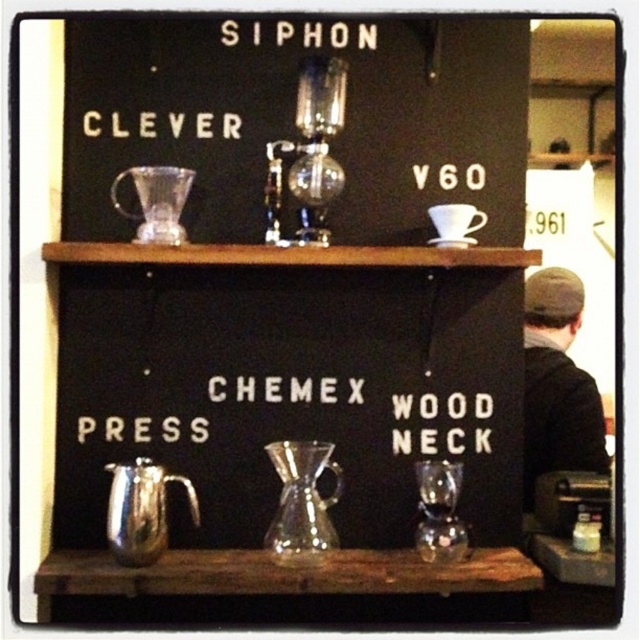
Who is taller, clear glass carafe at upper center or white ceramic cup at upper center?

With more height is clear glass carafe at upper center.

Which is behind, point (212, 88) or point (468, 211)?

The point (212, 88) is behind.

Where is `clear glass carafe at upper center`? The image size is (640, 640). clear glass carafe at upper center is located at coordinates (292, 118).

Is clear glass carafe at upper center positioned in front of dark gray knit cap at right?

Yes, clear glass carafe at upper center is closer to the viewer.

Does clear glass carafe at upper center appear under dark gray knit cap at right?

Incorrect, clear glass carafe at upper center is not positioned below dark gray knit cap at right.

Who is more forward, (92,90) or (552,394)?

Point (92,90) is more forward.

I want to click on clear glass carafe at upper center, so click(x=292, y=118).

Does clear glass carafe at upper center appear on the right side of white plastic chemex press at center?

Indeed, clear glass carafe at upper center is positioned on the right side of white plastic chemex press at center.

Is the position of clear glass carafe at upper center more distant than that of white plastic chemex press at center?

No, clear glass carafe at upper center is in front of white plastic chemex press at center.

Does point (378, 77) lie in front of point (333, 403)?

No, (378, 77) is further to viewer.

Find the location of a particular element. The image size is (640, 640). clear glass carafe at upper center is located at coordinates (292, 118).